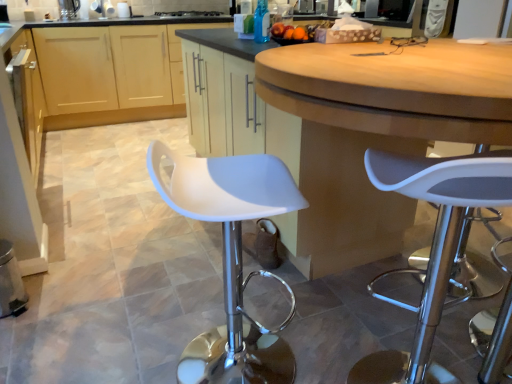
Question: Is white plastic stool at center far away from blue glass bottle at upper center?

Choices:
 (A) yes
 (B) no

Answer: (A)

Question: Would you say white plastic stool at center is outside blue glass bottle at upper center?

Choices:
 (A) no
 (B) yes

Answer: (B)

Question: Is blue glass bottle at upper center inside white plastic stool at center?

Choices:
 (A) yes
 (B) no

Answer: (B)

Question: Is white plastic stool at center positioned before blue glass bottle at upper center?

Choices:
 (A) yes
 (B) no

Answer: (A)

Question: Is white plastic stool at center smaller than blue glass bottle at upper center?

Choices:
 (A) no
 (B) yes

Answer: (A)

Question: Would you say matte white cabinet at center, marked as the second cabinetry in a back-to-front arrangement, is inside or outside white plastic stool at center?

Choices:
 (A) inside
 (B) outside

Answer: (B)

Question: Considering the positions of matte white cabinet at center, marked as the second cabinetry in a back-to-front arrangement, and white plastic stool at center in the image, is matte white cabinet at center, marked as the second cabinetry in a back-to-front arrangement, wider or thinner than white plastic stool at center?

Choices:
 (A) thin
 (B) wide

Answer: (B)

Question: From their relative heights in the image, would you say matte white cabinet at center, the 1th cabinetry viewed from the front, is taller or shorter than white plastic stool at center?

Choices:
 (A) tall
 (B) short

Answer: (A)

Question: Relative to white plastic stool at center, is matte white cabinet at center, marked as the second cabinetry in a back-to-front arrangement, in front or behind?

Choices:
 (A) behind
 (B) front

Answer: (A)

Question: From the image's perspective, is matte wood cabinets at center, the 1th cabinetry from the back, located above or below blue glass bottle at upper center?

Choices:
 (A) below
 (B) above

Answer: (B)

Question: From a real-world perspective, is matte wood cabinets at center, the second cabinetry in the front-to-back sequence, positioned above or below blue glass bottle at upper center?

Choices:
 (A) below
 (B) above

Answer: (A)

Question: Is point (53, 69) positioned closer to the camera than point (267, 13)?

Choices:
 (A) closer
 (B) farther

Answer: (B)

Question: Is matte wood cabinets at center, the 1th cabinetry from the back, inside the boundaries of blue glass bottle at upper center, or outside?

Choices:
 (A) inside
 (B) outside

Answer: (B)

Question: Choose the correct answer: Is white plastic stool at center inside white plastic stool at center or outside it?

Choices:
 (A) inside
 (B) outside

Answer: (B)

Question: Is white plastic stool at center wider or thinner than white plastic stool at center?

Choices:
 (A) wide
 (B) thin

Answer: (B)